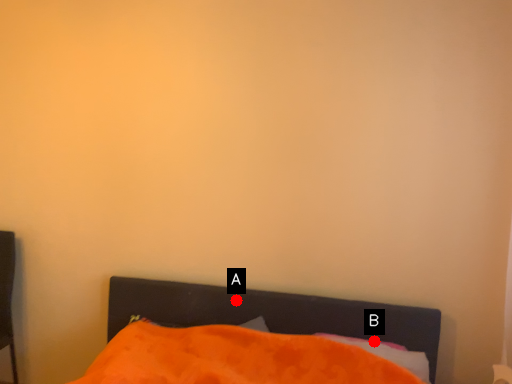
Question: Two points are circled on the image, labeled by A and B beside each circle. Which point is closer to the camera?

Choices:
 (A) A is closer
 (B) B is closer

Answer: (B)